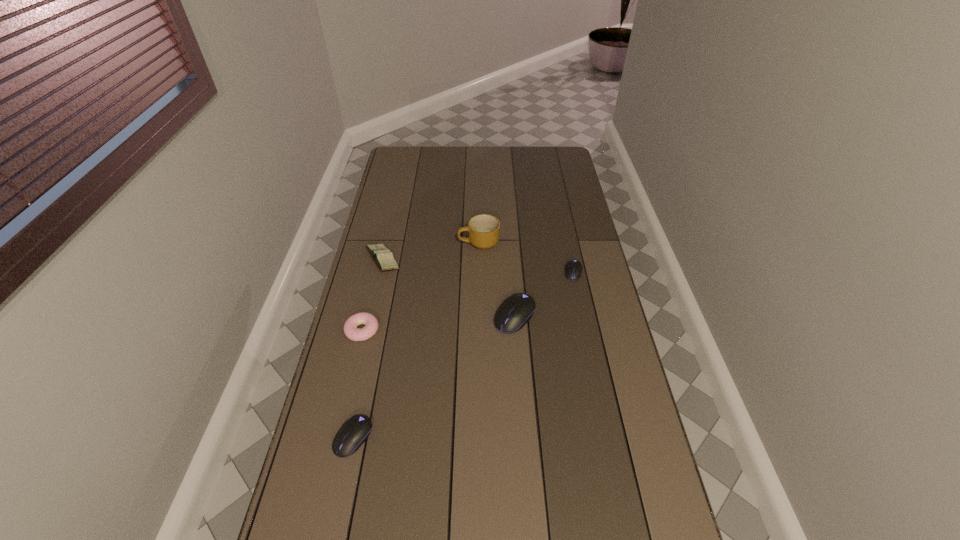
In order to click on vacant area that satisfies the following two spatial constraints: 1. on the back side of the second tallest computer mouse; 2. on the side with the handle of the tallest object in this screenshot , I will do `click(395, 242)`.